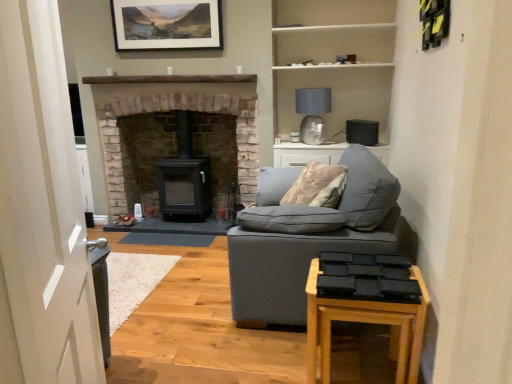
Question: From a real-world perspective, is white glossy door at left located higher than soft gray fabric couch at center?

Choices:
 (A) no
 (B) yes

Answer: (B)

Question: Considering the relative sizes of white glossy door at left and soft gray fabric couch at center in the image provided, is white glossy door at left taller than soft gray fabric couch at center?

Choices:
 (A) yes
 (B) no

Answer: (A)

Question: Does white glossy door at left appear on the left side of soft gray fabric couch at center?

Choices:
 (A) yes
 (B) no

Answer: (A)

Question: Can you confirm if white glossy door at left is wider than soft gray fabric couch at center?

Choices:
 (A) no
 (B) yes

Answer: (A)

Question: Is white glossy door at left oriented towards soft gray fabric couch at center?

Choices:
 (A) yes
 (B) no

Answer: (B)

Question: Considering the relative positions of wooden side table at lower right and black matte wood burning stove at center in the image provided, is wooden side table at lower right to the left or to the right of black matte wood burning stove at center?

Choices:
 (A) left
 (B) right

Answer: (B)

Question: In terms of height, does wooden side table at lower right look taller or shorter compared to black matte wood burning stove at center?

Choices:
 (A) tall
 (B) short

Answer: (B)

Question: Relative to black matte wood burning stove at center, is wooden side table at lower right in front or behind?

Choices:
 (A) front
 (B) behind

Answer: (A)

Question: Is point (329, 322) closer or farther from the camera than point (199, 218)?

Choices:
 (A) closer
 (B) farther

Answer: (A)

Question: Is matte gray fabric couch at center inside the boundaries of wooden side table at lower right, or outside?

Choices:
 (A) outside
 (B) inside

Answer: (A)

Question: Visually, is matte gray fabric couch at center positioned to the left or to the right of wooden side table at lower right?

Choices:
 (A) left
 (B) right

Answer: (A)

Question: Does point (276, 289) appear closer or farther from the camera than point (324, 360)?

Choices:
 (A) closer
 (B) farther

Answer: (B)

Question: From a real-world perspective, relative to wooden side table at lower right, is matte gray fabric couch at center vertically above or below?

Choices:
 (A) above
 (B) below

Answer: (A)

Question: Considering the positions of point (195, 77) and point (353, 24), is point (195, 77) closer or farther from the camera than point (353, 24)?

Choices:
 (A) closer
 (B) farther

Answer: (B)

Question: Looking at their shapes, would you say brick fireplace at center is wider or thinner than white matte shelves at upper center?

Choices:
 (A) thin
 (B) wide

Answer: (B)